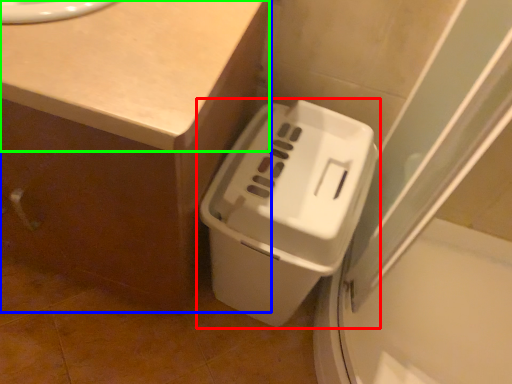
Question: Based on their relative distances, which object is nearer to waste container (highlighted by a red box)? Choose from counter (highlighted by a blue box) and counter top (highlighted by a green box).

Choices:
 (A) counter
 (B) counter top

Answer: (A)